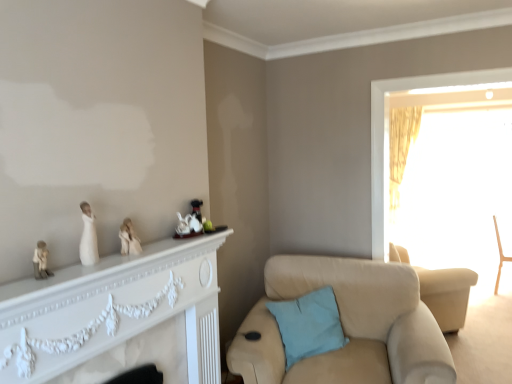
Find the location of a particular element. vacant space in front of white porcelain figurine at left, placed as the first person when sorted from front to back is located at coordinates (75, 278).